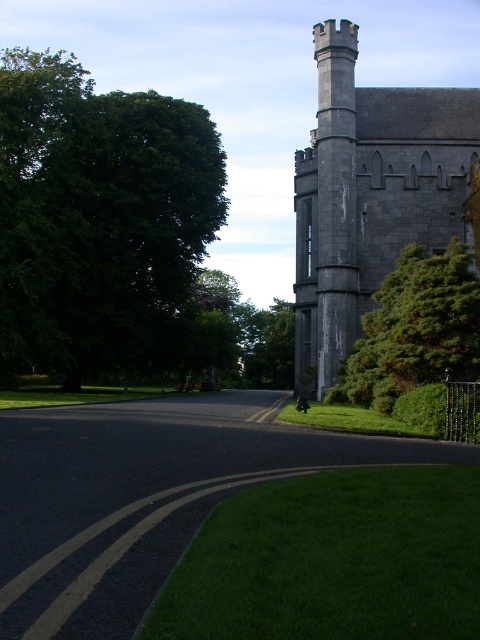
Does point (22, 116) come behind point (439, 317)?

Yes, it is behind point (439, 317).

Is green leafy tree at left thinner than green textured bush at right?

In fact, green leafy tree at left might be wider than green textured bush at right.

Does point (116, 125) come closer to viewer compared to point (385, 368)?

No, it is not.

Find the location of a particular element. The height and width of the screenshot is (640, 480). green leafy tree at left is located at coordinates (97, 216).

Between gray stone tower at upper right and green textured bush at right, which one appears on the left side from the viewer's perspective?

Positioned to the left is green textured bush at right.

Does gray stone tower at upper right have a lesser width compared to green textured bush at right?

In fact, gray stone tower at upper right might be wider than green textured bush at right.

Who is more distant from viewer, (321,152) or (392,362)?

The point (321,152) is behind.

Identify the location of gray stone tower at upper right. (370, 195).

Between green leafy tree at left and gray stone tower at upper right, which one is positioned higher?

Positioned higher is green leafy tree at left.

Does green leafy tree at left lie in front of gray stone tower at upper right?

That is False.

Locate an element on the screen. This screenshot has width=480, height=640. green leafy tree at left is located at coordinates (97, 216).